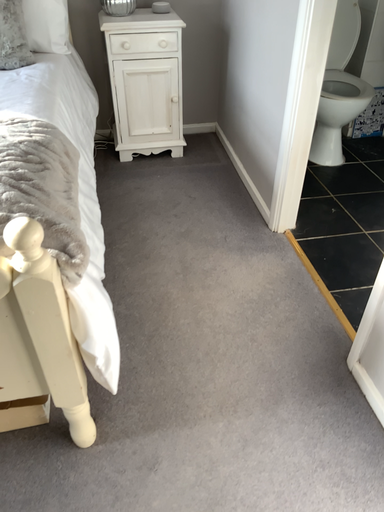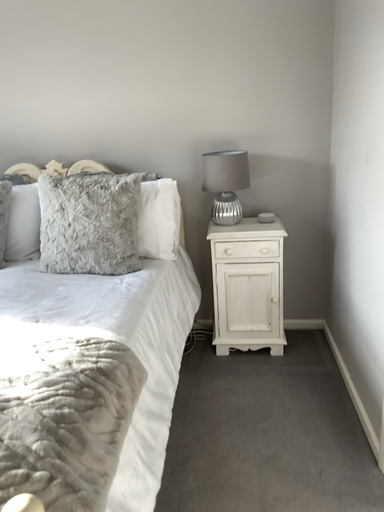
Question: How did the camera likely rotate when shooting the video?

Choices:
 (A) rotated left
 (B) rotated right

Answer: (A)